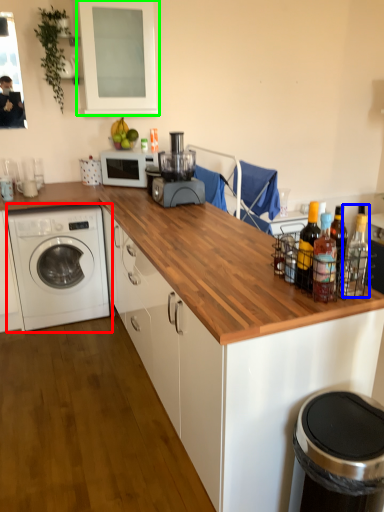
Question: Which object is positioned farthest from washing machine (highlighted by a red box)? Select from bottle (highlighted by a blue box) and window screen (highlighted by a green box).

Choices:
 (A) bottle
 (B) window screen

Answer: (A)